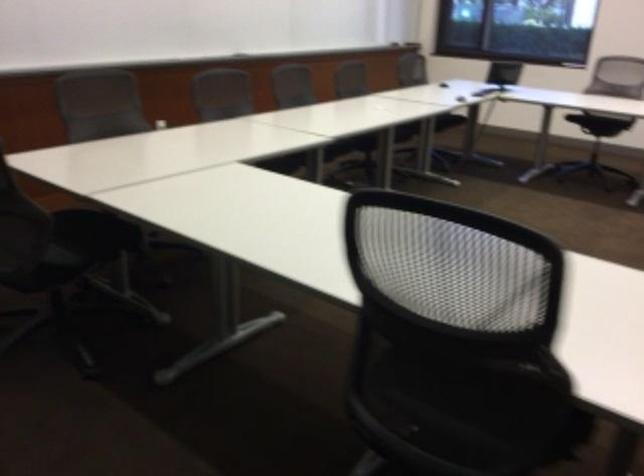
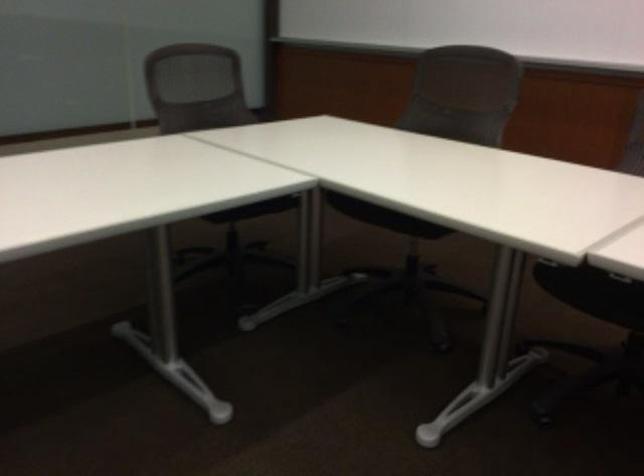
Where in the second image is the point corresponding to the point at 125,246 from the first image?

(254, 209)